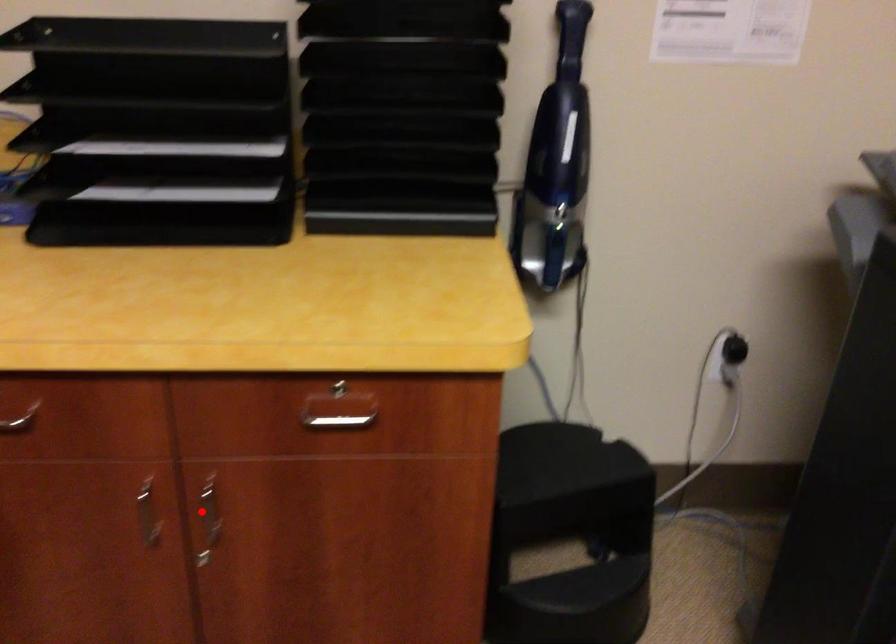
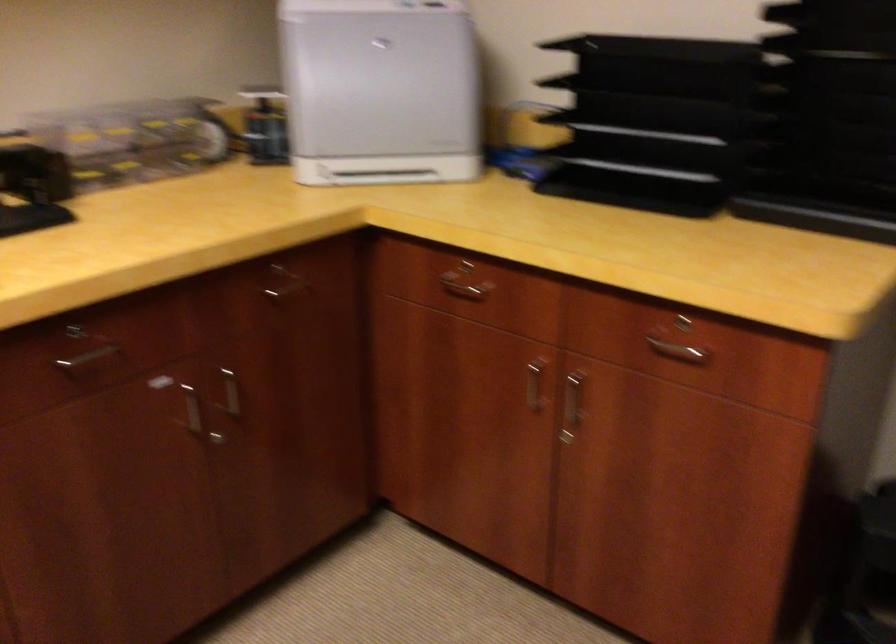
Where in the second image is the point corresponding to the highlighted location from the first image?

(572, 401)